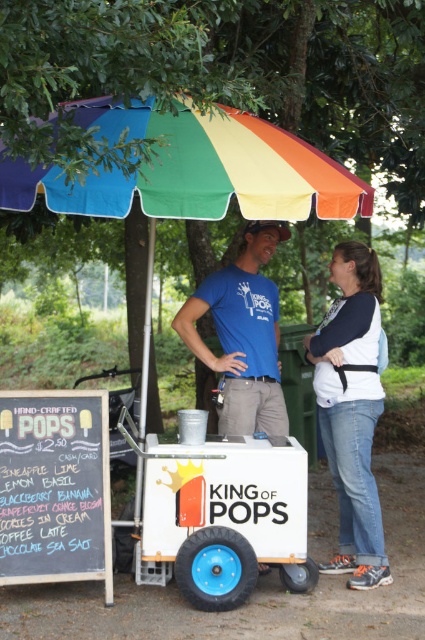
Who is positioned more to the left, white plastic cart at center or blue jeans at lower right?

white plastic cart at center is more to the left.

Does point (212, 454) come in front of point (370, 461)?

Yes, it is in front of point (370, 461).

I want to click on white plastic cart at center, so click(x=218, y=513).

Between white plastic cart at center and white matte ice cream cart at center, which one is positioned lower?

white plastic cart at center

Which is more to the left, white plastic cart at center or white matte ice cream cart at center?

white plastic cart at center is more to the left.

Is point (195, 476) closer to viewer compared to point (266, 248)?

That is True.

The width and height of the screenshot is (425, 640). Find the location of `white plastic cart at center`. white plastic cart at center is located at coordinates (218, 513).

Who is positioned more to the right, black chalkboard at lower left or blue t-shirt at center?

From the viewer's perspective, blue t-shirt at center appears more on the right side.

Does black chalkboard at lower left have a greater height compared to blue t-shirt at center?

No.

Is point (0, 566) positioned after point (289, 234)?

No, it is not.

The width and height of the screenshot is (425, 640). I want to click on black chalkboard at lower left, so click(54, 486).